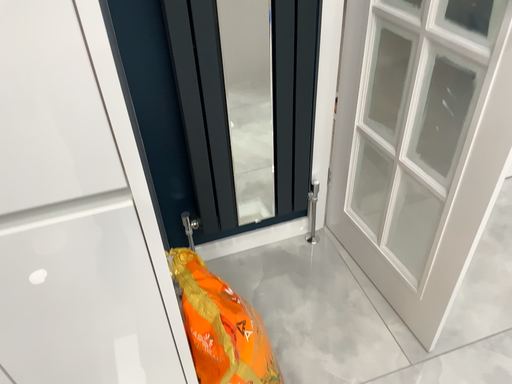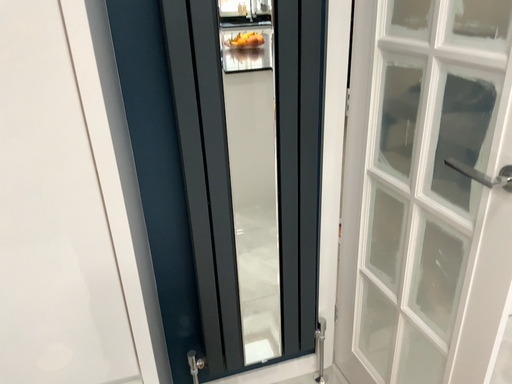
Question: Which way did the camera rotate in the video?

Choices:
 (A) rotated upward
 (B) rotated downward

Answer: (A)